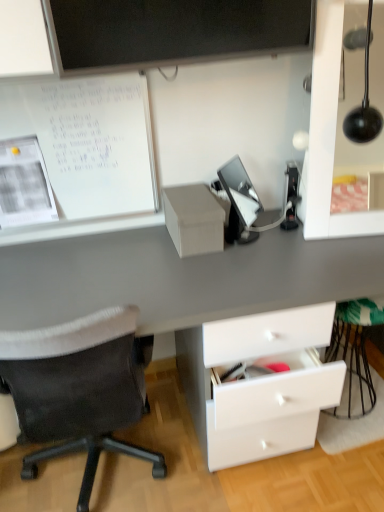
Where is `vacant space to the right of matte cardboard box at center`? vacant space to the right of matte cardboard box at center is located at coordinates (268, 238).